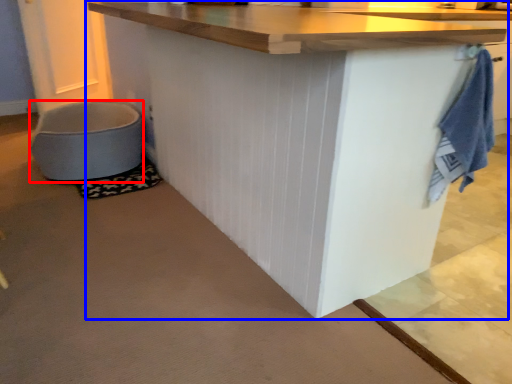
Question: Among these objects, which one is farthest to the camera, toilet bowl (highlighted by a red box) or table (highlighted by a blue box)?

Choices:
 (A) toilet bowl
 (B) table

Answer: (A)